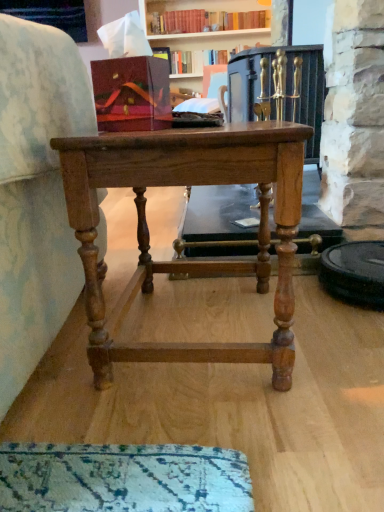
Question: Does hardcover book at upper center appear on the right side of light brown wood table at center?

Choices:
 (A) yes
 (B) no

Answer: (A)

Question: Considering the relative sizes of hardcover book at upper center and light brown wood table at center in the image provided, is hardcover book at upper center taller than light brown wood table at center?

Choices:
 (A) no
 (B) yes

Answer: (A)

Question: Is light brown wood table at center at the back of hardcover book at upper center?

Choices:
 (A) yes
 (B) no

Answer: (B)

Question: Is hardcover book at upper center bigger than light brown wood table at center?

Choices:
 (A) no
 (B) yes

Answer: (A)

Question: From a real-world perspective, is hardcover book at upper center under light brown wood table at center?

Choices:
 (A) yes
 (B) no

Answer: (B)

Question: Does hardcover book at upper center touch light brown wood table at center?

Choices:
 (A) yes
 (B) no

Answer: (B)

Question: Considering the relative sizes of light brown wood table at center and hardcover book at upper center in the image provided, is light brown wood table at center thinner than hardcover book at upper center?

Choices:
 (A) yes
 (B) no

Answer: (B)

Question: Is light brown wood table at center smaller than hardcover book at upper center?

Choices:
 (A) no
 (B) yes

Answer: (A)

Question: Can you confirm if light brown wood table at center is shorter than hardcover book at upper center?

Choices:
 (A) yes
 (B) no

Answer: (B)

Question: From a real-world perspective, does light brown wood table at center sit lower than hardcover book at upper center?

Choices:
 (A) yes
 (B) no

Answer: (A)

Question: Is light brown wood table at center oriented towards hardcover book at upper center?

Choices:
 (A) yes
 (B) no

Answer: (B)

Question: Is light brown wood table at center bigger than hardcover book at upper center?

Choices:
 (A) no
 (B) yes

Answer: (B)

Question: Is matte wood cabinet at upper left bigger than light brown wood table at center?

Choices:
 (A) no
 (B) yes

Answer: (A)